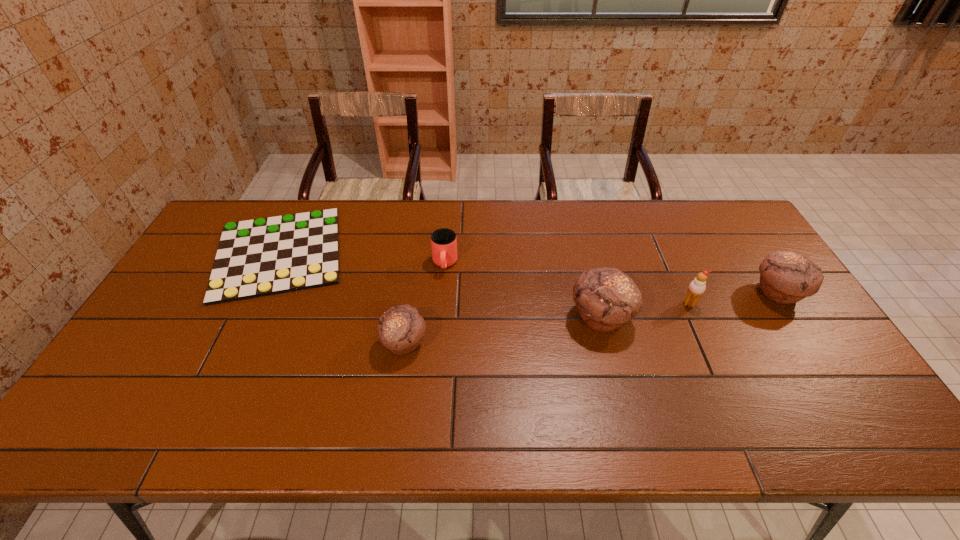
All muffins are currently evenly spaced. To continue this pattern, where would you add another muffin on the left? Please point out a vacant spot. Please provide its 2D coordinates. Your answer should be formatted as a tuple, i.e. [(x, y)], where the tuple contains the x and y coordinates of a point satisfying the conditions above.

[(185, 373)]